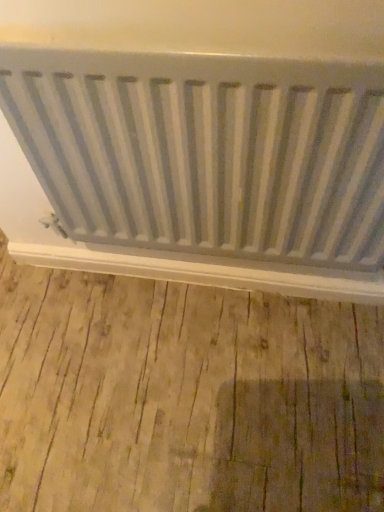
Question: Is white matte radiator at lower center located outside white matte radiator at center?

Choices:
 (A) yes
 (B) no

Answer: (A)

Question: Considering the relative positions of white matte radiator at lower center and white matte radiator at center in the image provided, is white matte radiator at lower center to the right of white matte radiator at center from the viewer's perspective?

Choices:
 (A) yes
 (B) no

Answer: (B)

Question: Does white matte radiator at lower center have a greater height compared to white matte radiator at center?

Choices:
 (A) no
 (B) yes

Answer: (A)

Question: From a real-world perspective, is white matte radiator at lower center positioned over white matte radiator at center based on gravity?

Choices:
 (A) yes
 (B) no

Answer: (B)

Question: Can you confirm if white matte radiator at lower center is thinner than white matte radiator at center?

Choices:
 (A) yes
 (B) no

Answer: (A)

Question: From the image's perspective, is white matte radiator at lower center below white matte radiator at center?

Choices:
 (A) yes
 (B) no

Answer: (A)

Question: Is white matte radiator at center placed right next to white matte radiator at lower center?

Choices:
 (A) yes
 (B) no

Answer: (B)

Question: Considering the relative sizes of white matte radiator at center and white matte radiator at lower center in the image provided, is white matte radiator at center shorter than white matte radiator at lower center?

Choices:
 (A) no
 (B) yes

Answer: (A)

Question: Can white matte radiator at lower center be found inside white matte radiator at center?

Choices:
 (A) yes
 (B) no

Answer: (B)

Question: Does white matte radiator at center have a smaller size compared to white matte radiator at lower center?

Choices:
 (A) yes
 (B) no

Answer: (B)

Question: From a real-world perspective, is white matte radiator at center positioned over white matte radiator at lower center based on gravity?

Choices:
 (A) yes
 (B) no

Answer: (A)

Question: Is white matte radiator at center further to camera compared to white matte radiator at lower center?

Choices:
 (A) yes
 (B) no

Answer: (B)

Question: Relative to white matte radiator at center, is white matte radiator at lower center in front or behind?

Choices:
 (A) front
 (B) behind

Answer: (B)